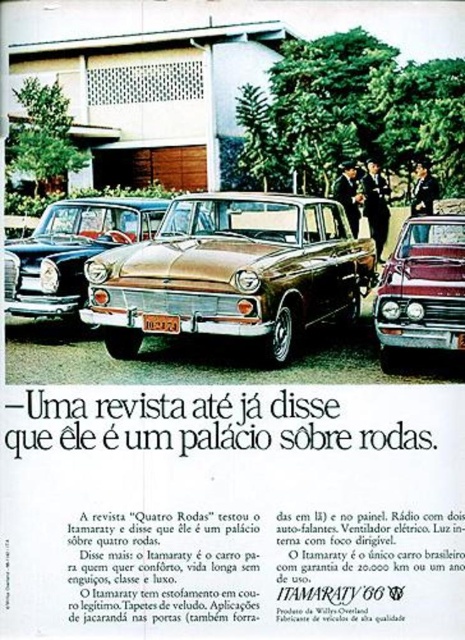
You are a delivery person who needs to place a yellow plastic license plate at center onto the gold metallic car at center. The license plate is 12 inches wide. Can the license plate fit horizontally on the car?

The gold metallic car at center might be wider than the yellow plastic license plate at center, so it is possible that the license plate can fit horizontally on the car.

You are a photographer setting up a shot for a car advertisement. You need to ensure that the shiny maroon sedan at right and the yellow plastic license plate at center are both visible in your frame. Based on their positions, which object is located to the right of the other?

The shiny maroon sedan at right is positioned on the right side of yellow plastic license plate at center, so the shiny maroon sedan at right is to the right of the yellow plastic license plate at center.